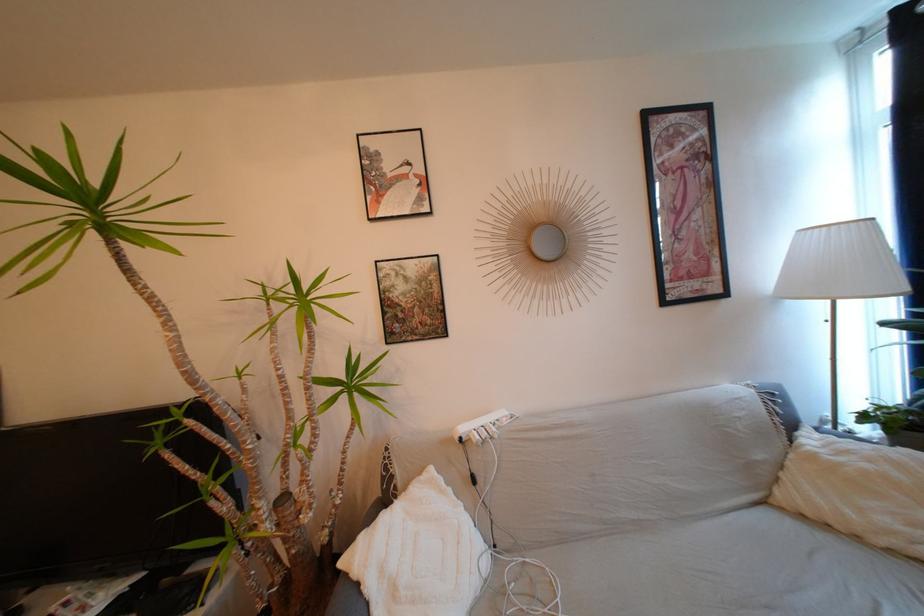
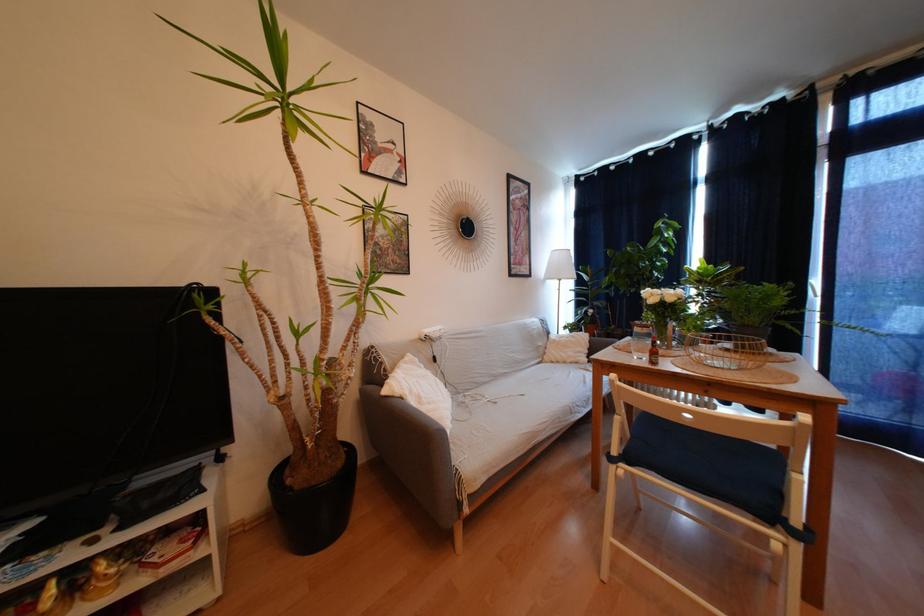
Question: The first image is from the beginning of the video and the second image is from the end. How did the camera likely rotate when shooting the video?

Choices:
 (A) Left
 (B) Right
 (C) Up
 (D) Down

Answer: (B)